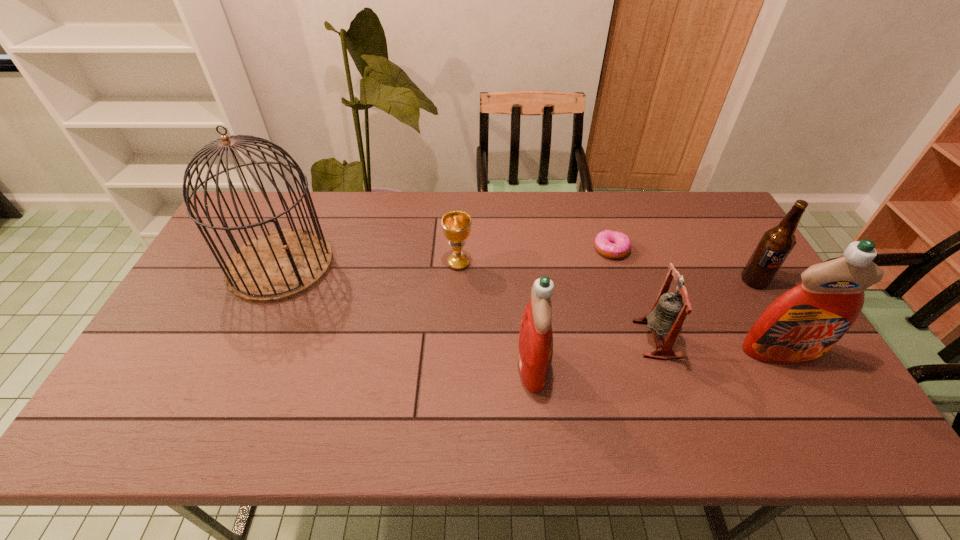
In the current image, all detergents are evenly spaced. To maintain this equal spacing, where should an additional detergent be placed on the left? Please point out a free spot. Please provide its 2D coordinates. Your answer should be formatted as a tuple, i.e. [(x, y)], where the tuple contains the x and y coordinates of a point satisfying the conditions above.

[(271, 379)]